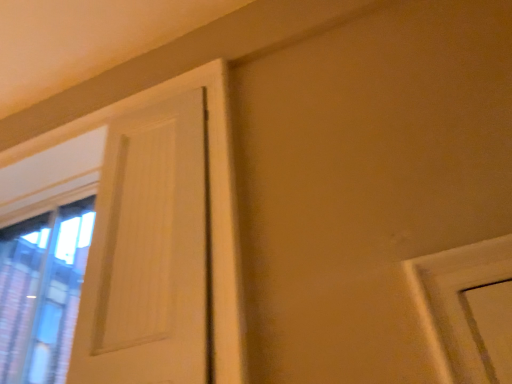
In order to face white wood door at left, should I rotate leftwards or rightwards?

Rotate left and turn 15.463 degrees.

Locate an element on the screen. white wood door at left is located at coordinates (148, 253).

What do you see at coordinates (148, 253) in the screenshot?
I see `white wood door at left` at bounding box center [148, 253].

Where is `white wood door at left`? The width and height of the screenshot is (512, 384). white wood door at left is located at coordinates (148, 253).